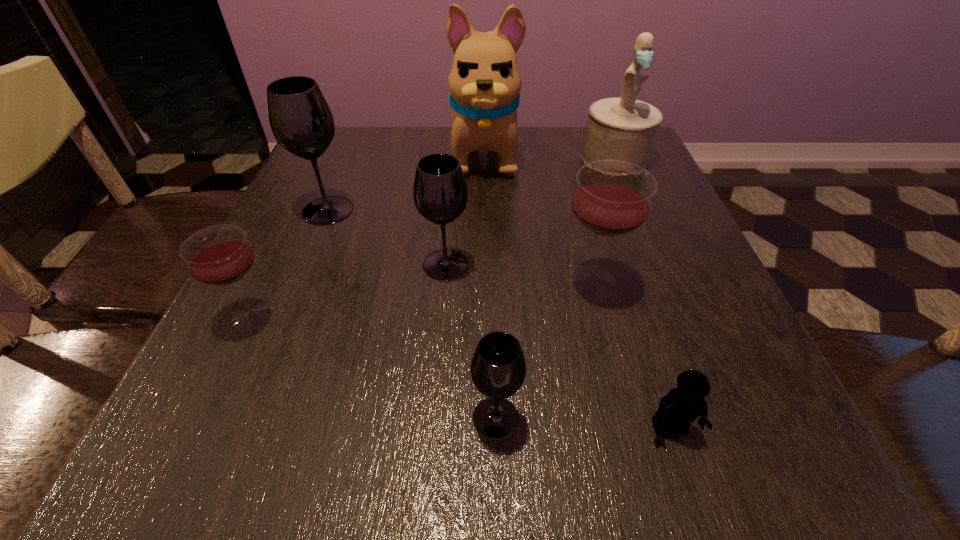
Where is `gray wineglass that is the closest to the smallest gray wineglass`? gray wineglass that is the closest to the smallest gray wineglass is located at coordinates (440, 193).

Locate an element on the screen. The image size is (960, 540). gray wineglass that is the closest to the second biggest gray wineglass is located at coordinates point(302,123).